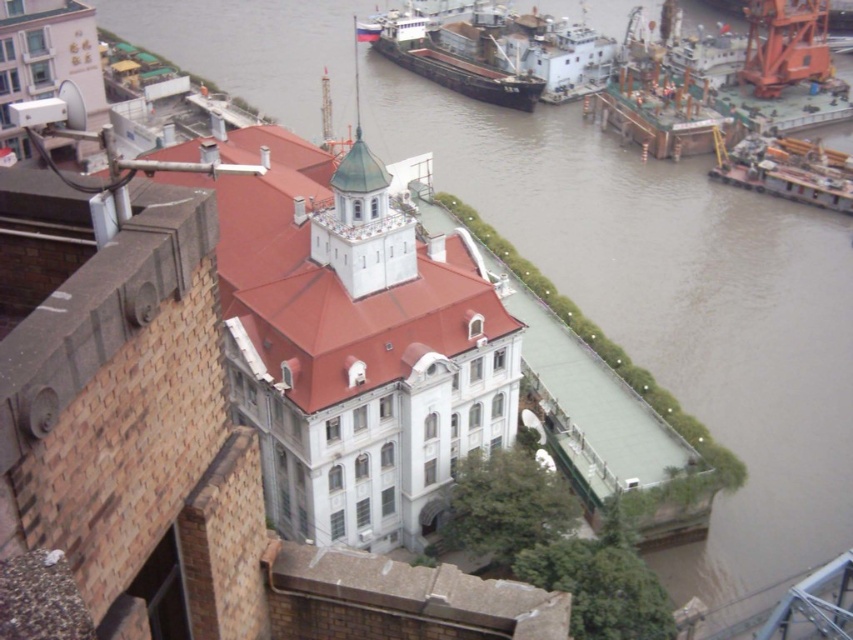
Question: Which object appears closest to the camera in this image?

Choices:
 (A) brown matte cargo ship at upper right
 (B) metallic gray barge at right

Answer: (B)

Question: Can you confirm if brown matte cargo ship at upper right is wider than metallic gray barge at right?

Choices:
 (A) yes
 (B) no

Answer: (A)

Question: Can you confirm if brown matte cargo ship at upper right is positioned to the right of metallic gray barge at right?

Choices:
 (A) yes
 (B) no

Answer: (B)

Question: Can you confirm if brown matte cargo ship at upper right is bigger than metallic gray barge at right?

Choices:
 (A) no
 (B) yes

Answer: (B)